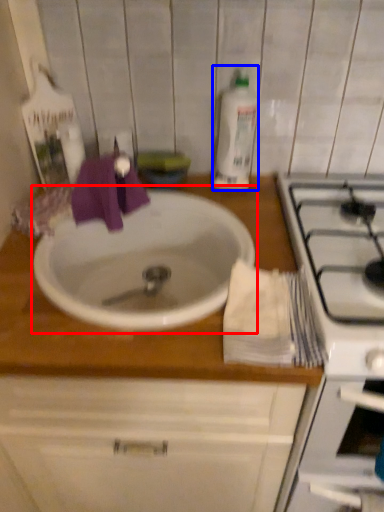
Question: Which of the following is the closest to the observer, sink (highlighted by a red box) or cleaning product (highlighted by a blue box)?

Choices:
 (A) sink
 (B) cleaning product

Answer: (A)